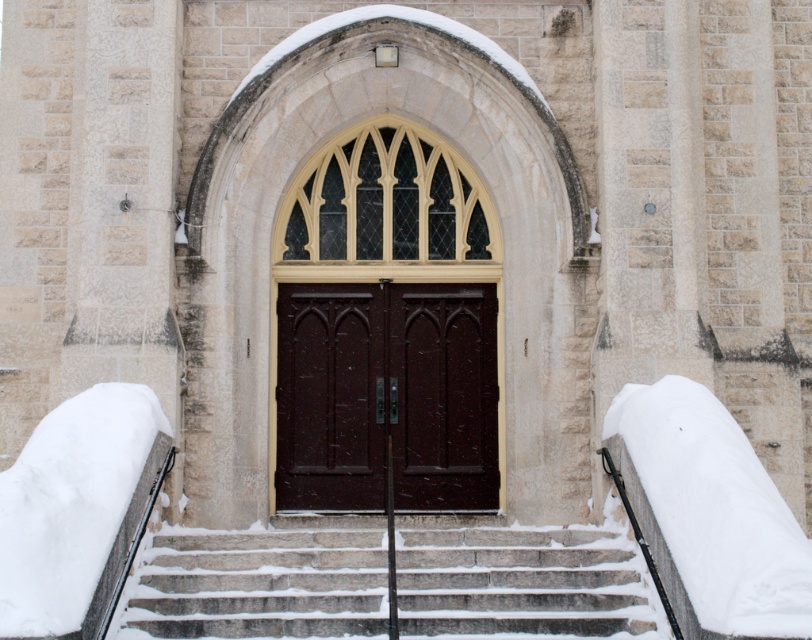
Who is shorter, gray stone stairs at center or dark wood doors at center?

gray stone stairs at center is shorter.

Between point (128, 616) and point (391, 433), which one is positioned in front?

Point (128, 616) is more forward.

Between point (290, 630) and point (369, 284), which one is positioned in front?

Point (290, 630) is in front.

Locate an element on the screen. gray stone stairs at center is located at coordinates (262, 580).